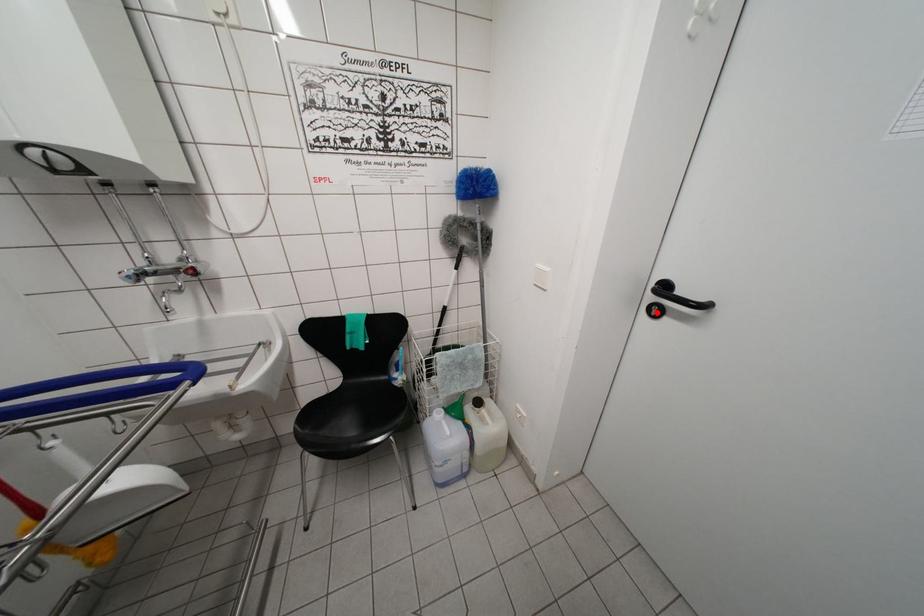
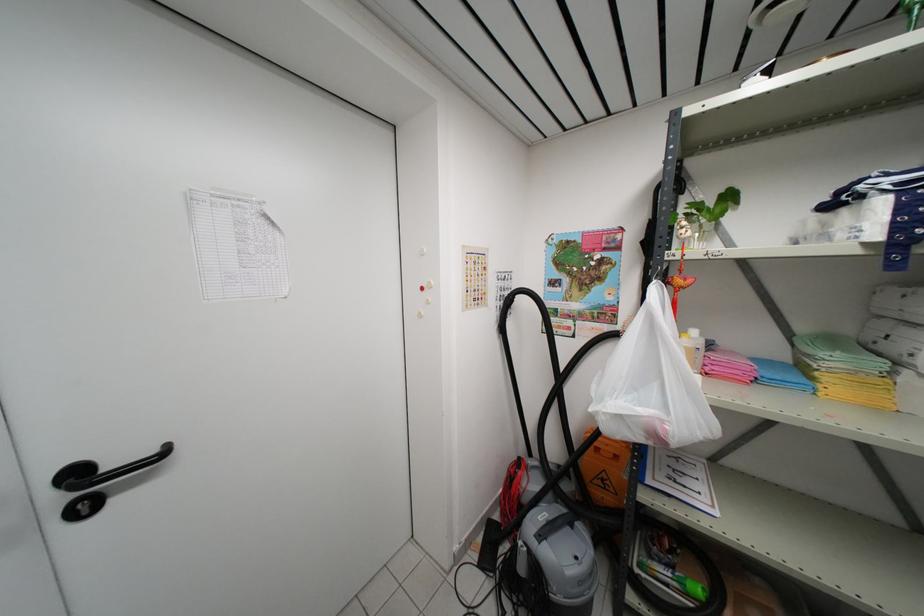
Question: A red point is marked in image1. In image2, is the corresponding 3D point closer to the camera or farther? Reply with the corresponding letter.

Choices:
 (A) The corresponding 3D point is closer.
 (B) The corresponding 3D point is farther.

Answer: (A)